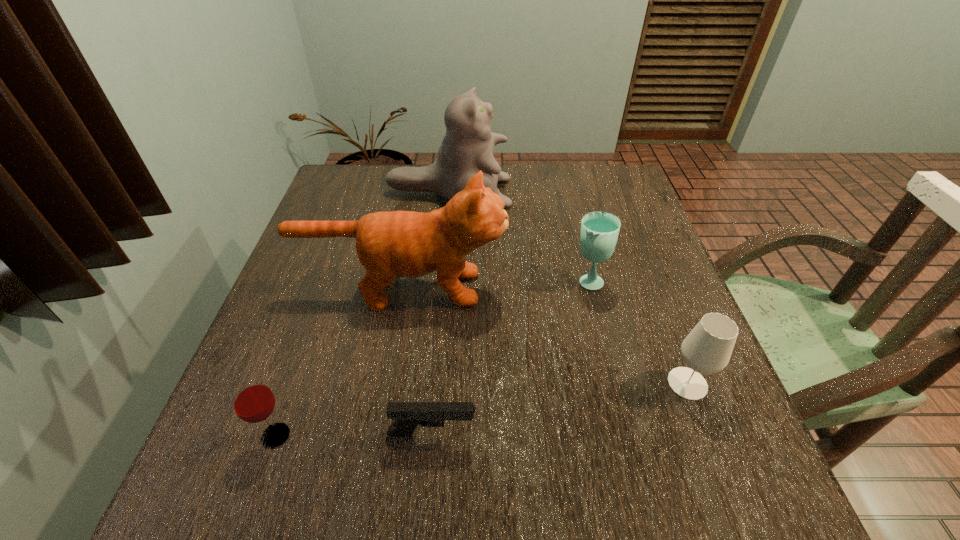
Identify which object is located as the fifth nearest to the nearest glass. Please provide its 2D coordinates. Your answer should be formatted as a tuple, i.e. [(x, y)], where the tuple contains the x and y coordinates of a point satisfying the conditions above.

[(707, 349)]

Point out which object is positioned as the fifth nearest to the farther cat. Please provide its 2D coordinates. Your answer should be formatted as a tuple, i.e. [(x, y)], where the tuple contains the x and y coordinates of a point satisfying the conditions above.

[(408, 415)]

Where is `glass object that ranks as the closest to the second glass from right to left`? The width and height of the screenshot is (960, 540). glass object that ranks as the closest to the second glass from right to left is located at coordinates (707, 349).

Find the location of a particular element. This screenshot has width=960, height=540. the second closest glass to the nearer cat is located at coordinates (252, 400).

Where is `free region that satisfies the following two spatial constraints: 1. on the front side of the second glass from right to left; 2. on the left side of the fourth farthest object`? This screenshot has height=540, width=960. free region that satisfies the following two spatial constraints: 1. on the front side of the second glass from right to left; 2. on the left side of the fourth farthest object is located at coordinates (613, 383).

Identify the location of vacant space that satisfies the following two spatial constraints: 1. on the face of the fourth farthest object; 2. on the right side of the nearer cat. Image resolution: width=960 pixels, height=540 pixels. (386, 383).

Find the location of `vacant area in the image that satisfies the following two spatial constraints: 1. on the front side of the second glass from right to left; 2. on the left side of the rightmost object`. vacant area in the image that satisfies the following two spatial constraints: 1. on the front side of the second glass from right to left; 2. on the left side of the rightmost object is located at coordinates (613, 383).

You are a GUI agent. You are given a task and a screenshot of the screen. Output one action in this format:
    pyautogui.click(x=<x>, y=<y>)
    Task: Click on the vacant space that satisfies the following two spatial constraints: 1. on the front side of the farthest glass; 2. on the face of the nearer cat
    The image size is (960, 540).
    Given the screenshot: What is the action you would take?
    pyautogui.click(x=589, y=288)

Locate an element on the screen. This screenshot has width=960, height=540. free space that satisfies the following two spatial constraints: 1. on the face of the farthest object; 2. on the back side of the fifth object from left to right is located at coordinates (442, 280).